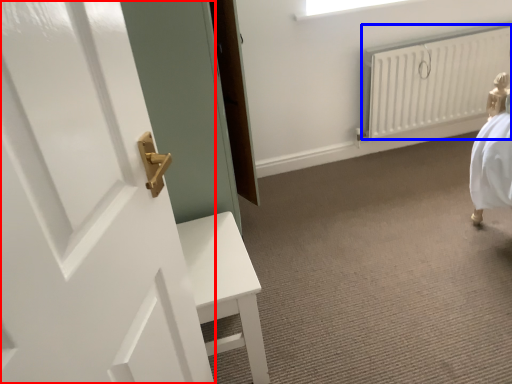
Question: Among these objects, which one is nearest to the camera, door (highlighted by a red box) or radiator (highlighted by a blue box)?

Choices:
 (A) door
 (B) radiator

Answer: (A)